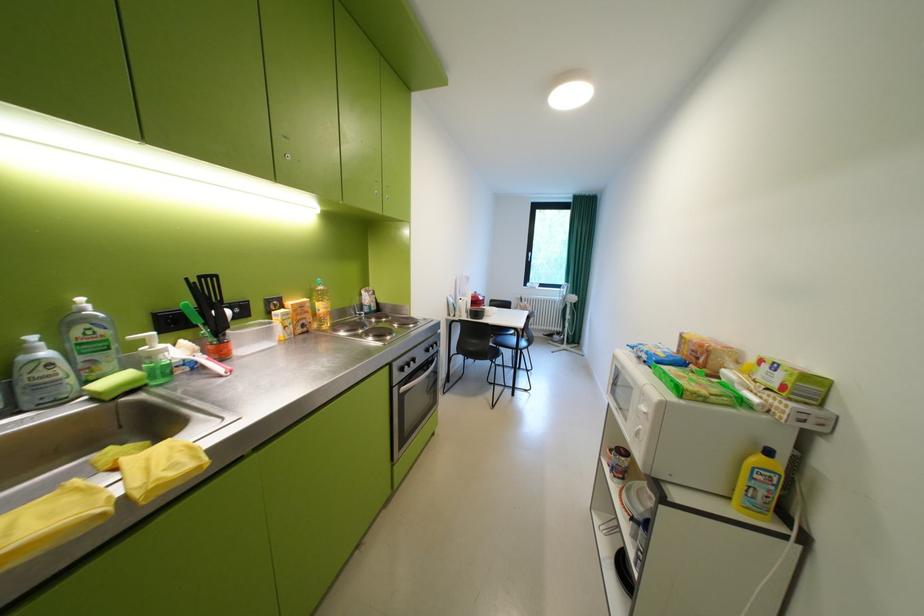
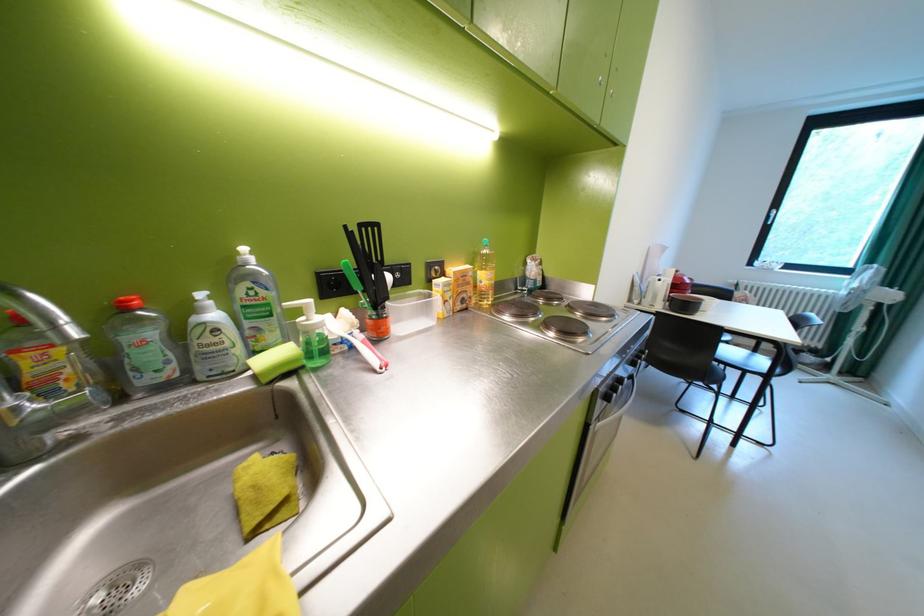
Question: The images are taken continuously from a first-person perspective. In which direction is your viewpoint rotating?

Choices:
 (A) Left
 (B) Right
 (C) Up
 (D) Down

Answer: (A)